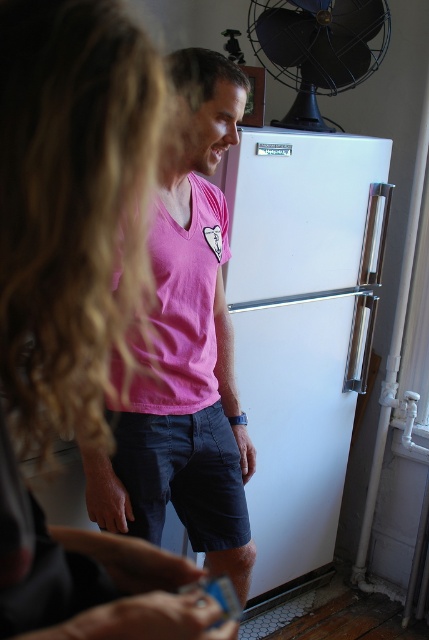
Question: Is blonde hair at upper left to the right of white matte refrigerator at right from the viewer's perspective?

Choices:
 (A) yes
 (B) no

Answer: (B)

Question: Can you confirm if blonde hair at upper left is wider than white matte refrigerator at right?

Choices:
 (A) yes
 (B) no

Answer: (B)

Question: Which object is positioned farthest from the blonde hair at upper left?

Choices:
 (A) black metal fan at upper right
 (B) white matte refrigerator at right
 (C) pink cotton shirt at center

Answer: (A)

Question: Among these objects, which one is nearest to the camera?

Choices:
 (A) pink cotton shirt at center
 (B) blonde hair at upper left
 (C) black metal fan at upper right
 (D) white matte refrigerator at right

Answer: (B)

Question: Is blonde hair at upper left to the left of black metal fan at upper right from the viewer's perspective?

Choices:
 (A) no
 (B) yes

Answer: (B)

Question: Estimate the real-world distances between objects in this image. Which object is closer to the blonde hair at upper left?

Choices:
 (A) black metal fan at upper right
 (B) white matte refrigerator at right

Answer: (B)